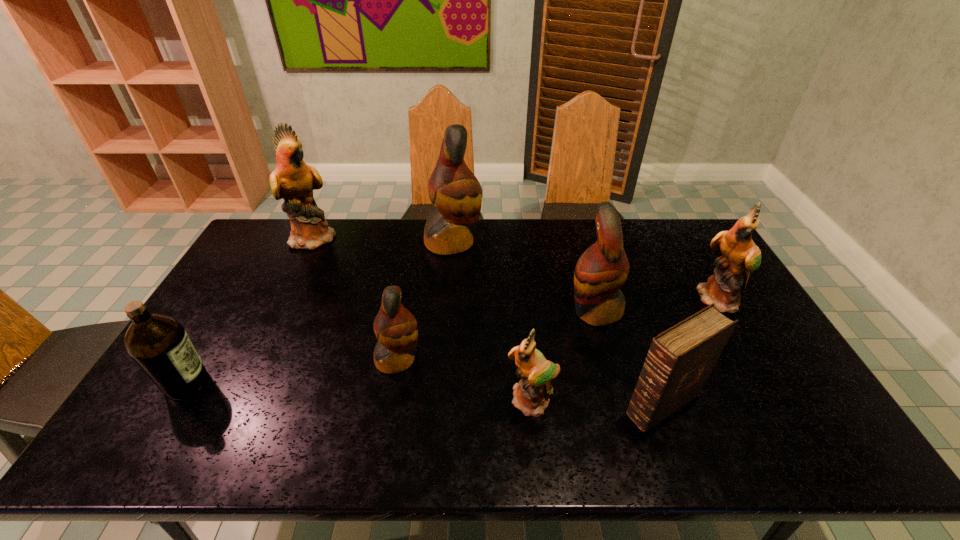
Where is `vacant area that lies between the rightmost green parrot and the nearest red parrot`? vacant area that lies between the rightmost green parrot and the nearest red parrot is located at coordinates (560, 329).

Select which object appears as the second closest to the leftmost object. Please provide its 2D coordinates. Your answer should be formatted as a tuple, i.e. [(x, y)], where the tuple contains the x and y coordinates of a point satisfying the conditions above.

[(292, 180)]

Point out which object is positioned as the sixth nearest to the nearest parrot. Please provide its 2D coordinates. Your answer should be formatted as a tuple, i.e. [(x, y)], where the tuple contains the x and y coordinates of a point satisfying the conditions above.

[(159, 345)]

Identify the location of the second closest parrot relative to the biggest red parrot. (603, 268).

Find the location of a particular element. This screenshot has width=960, height=540. parrot that is the second closest to the second farthest green parrot is located at coordinates point(531,395).

Select which green parrot appears as the second closest to the nearest red parrot. Please provide its 2D coordinates. Your answer should be formatted as a tuple, i.e. [(x, y)], where the tuple contains the x and y coordinates of a point satisfying the conditions above.

[(292, 180)]

Locate which green parrot is the closest to the Bible. Please provide its 2D coordinates. Your answer should be formatted as a tuple, i.e. [(x, y)], where the tuple contains the x and y coordinates of a point satisfying the conditions above.

[(531, 395)]

Identify which red parrot is located as the second nearest to the brown olive oil. Please provide its 2D coordinates. Your answer should be formatted as a tuple, i.e. [(x, y)], where the tuple contains the x and y coordinates of a point satisfying the conditions above.

[(455, 192)]

Choose which red parrot is the nearest neighbor to the second biggest red parrot. Please provide its 2D coordinates. Your answer should be formatted as a tuple, i.e. [(x, y)], where the tuple contains the x and y coordinates of a point satisfying the conditions above.

[(455, 192)]

At what (x,y) coordinates should I click in order to perform the action: click on free point that satisfies the following two spatial constraints: 1. on the face of the Bible; 2. on the right side of the second nearest red parrot. Please return your answer as a coordinate pair (x, y). Looking at the image, I should click on (621, 405).